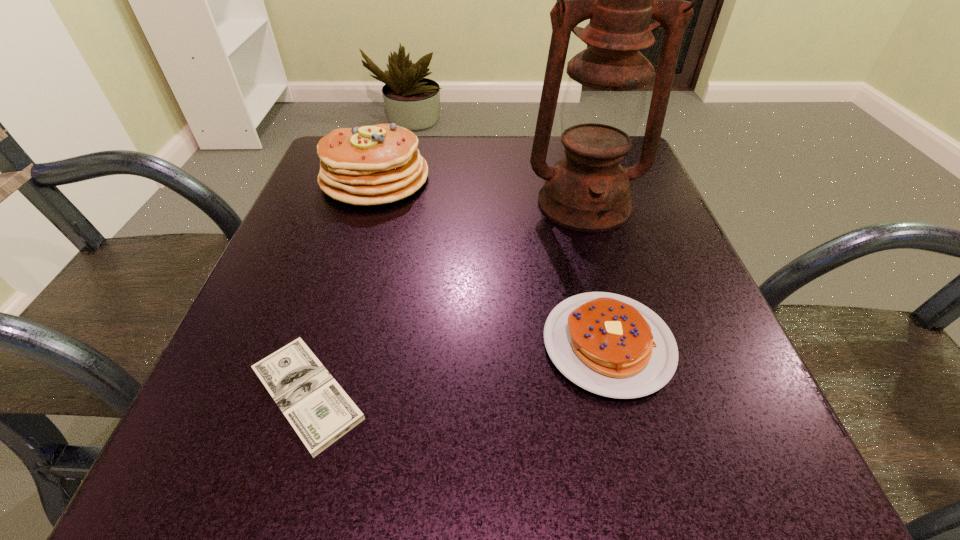
I want to click on oil lamp at the far edge, so click(603, 106).

The height and width of the screenshot is (540, 960). Identify the location of pancake present at the far edge. (369, 165).

What are the coordinates of `object at the near edge` in the screenshot? It's located at (318, 409).

Image resolution: width=960 pixels, height=540 pixels. What are the coordinates of `pancake located at the left edge` in the screenshot? It's located at (369, 165).

Identify the location of dollar situated at the left edge. (318, 409).

Find the location of a particular element. The image size is (960, 540). oil lamp situated at the right edge is located at coordinates (603, 106).

The width and height of the screenshot is (960, 540). In order to click on pancake that is at the right edge in this screenshot , I will do `click(611, 345)`.

Locate an element on the screen. This screenshot has width=960, height=540. object present at the far left corner is located at coordinates tap(369, 165).

The image size is (960, 540). I want to click on object that is at the near left corner, so click(318, 409).

This screenshot has height=540, width=960. What are the coordinates of `object located at the far right corner` in the screenshot? It's located at (603, 106).